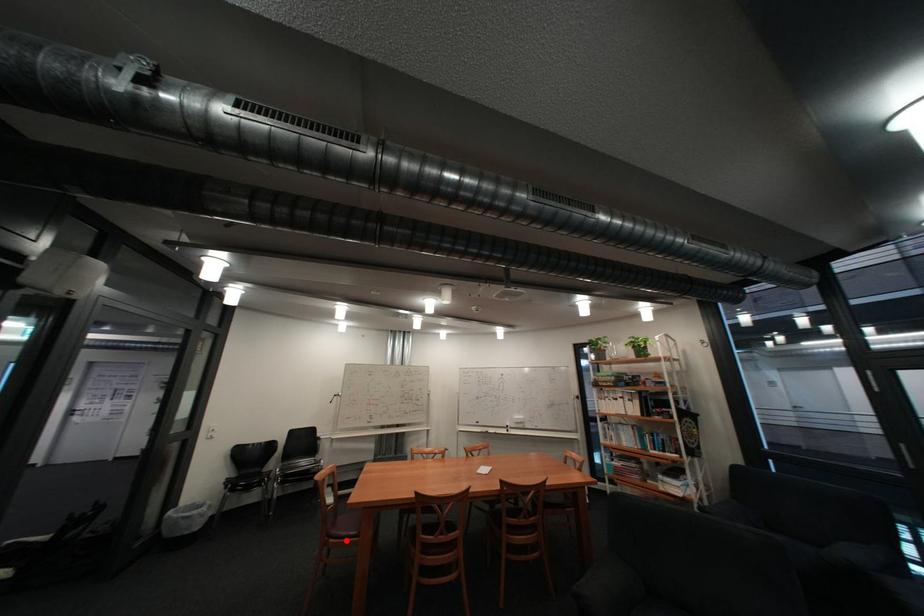
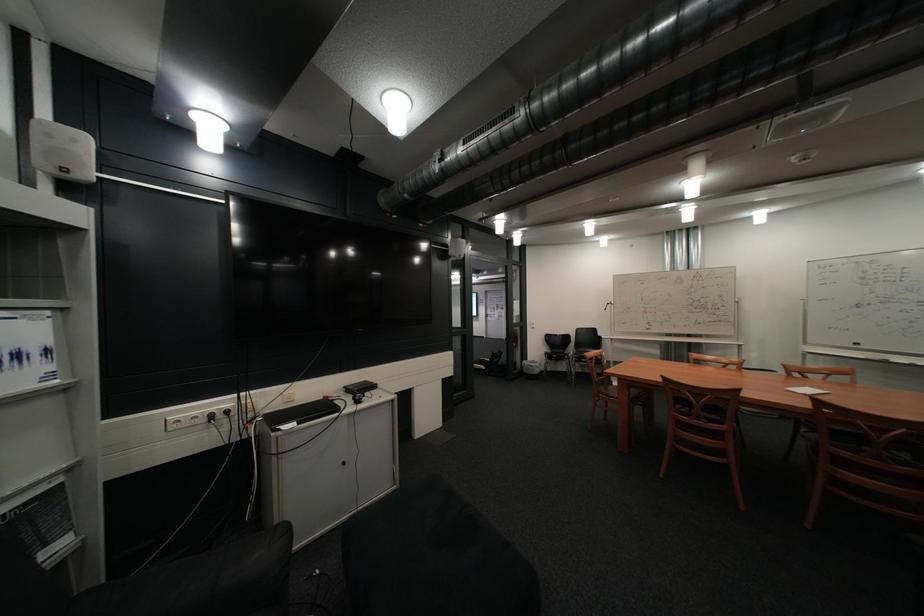
In the second image, find the point that corresponds to the highlighted location in the first image.

(615, 395)